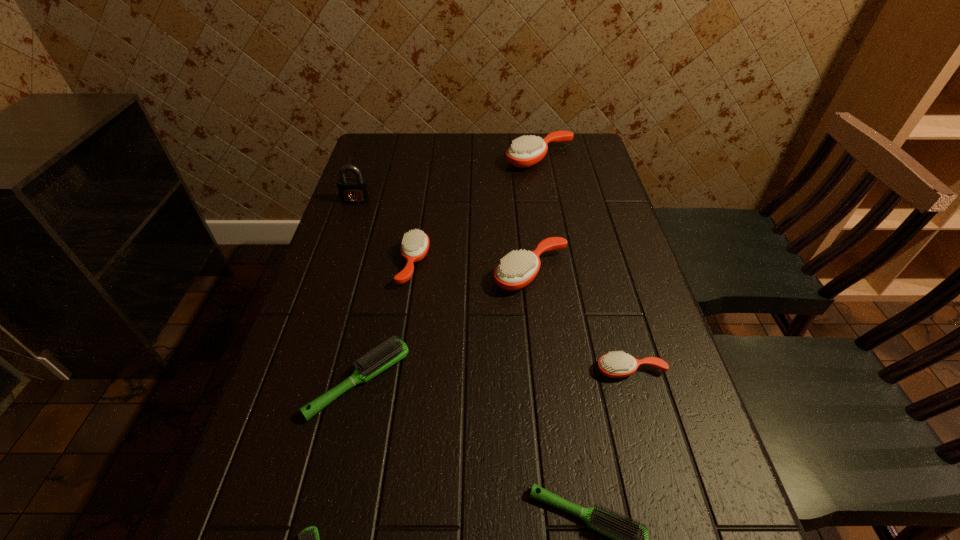
You are a GUI agent. You are given a task and a screenshot of the screen. Output one action in this format:
    pyautogui.click(x=<x>, y=<y>)
    Task: Click on the gray padlock
    
    Given the screenshot: What is the action you would take?
    pyautogui.click(x=355, y=190)

Locate an element on the screen. This screenshot has width=960, height=540. the tallest object is located at coordinates (355, 190).

The image size is (960, 540). I want to click on the seventh shortest object, so click(x=526, y=151).

The height and width of the screenshot is (540, 960). In order to click on the farthest orange hairbrush in this screenshot , I will do `click(526, 151)`.

Locate an element on the screen. the sixth shortest object is located at coordinates (516, 270).

You are a GUI agent. You are given a task and a screenshot of the screen. Output one action in this format:
    pyautogui.click(x=<x>, y=<y>)
    Task: Click on the sixth shortest hairbrush
    The image size is (960, 540).
    Given the screenshot: What is the action you would take?
    point(516,270)

The image size is (960, 540). What are the coordinates of `the fourth tallest object` in the screenshot? It's located at (415, 244).

This screenshot has width=960, height=540. What are the coordinates of `the third tallest hairbrush` in the screenshot? It's located at coord(415,244).

I want to click on the farthest light hairbrush, so click(375, 362).

Where is `the smallest orange hairbrush`? Image resolution: width=960 pixels, height=540 pixels. the smallest orange hairbrush is located at coordinates (615, 364).